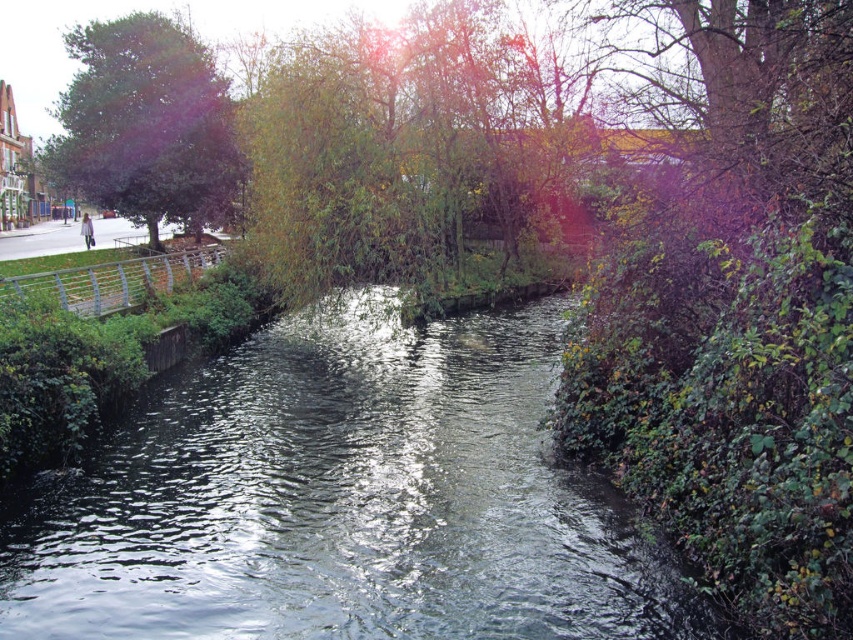
Question: Which point is closer to the camera taking this photo?

Choices:
 (A) (477, 580)
 (B) (97, 188)

Answer: (A)

Question: Does clear water at center appear on the right side of green leafy tree at left?

Choices:
 (A) no
 (B) yes

Answer: (B)

Question: Which object appears closest to the camera in this image?

Choices:
 (A) clear water at center
 (B) green leafy tree at left

Answer: (A)

Question: Is clear water at center wider than green leafy tree at left?

Choices:
 (A) no
 (B) yes

Answer: (A)

Question: Which object appears farthest from the camera in this image?

Choices:
 (A) green leafy tree at left
 (B) clear water at center

Answer: (A)

Question: Observing the image, what is the correct spatial positioning of clear water at center in reference to green leafy tree at left?

Choices:
 (A) above
 (B) below

Answer: (B)